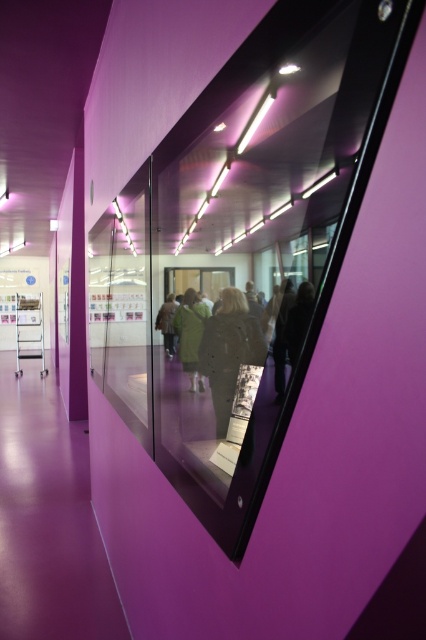
You are standing in the corridor with the purple walls and want to take a photo of the point at coordinates (230,305). Is the point within your camera frame?

The point at coordinates (230,305) is 1.01 meters away from the camera, so it is within the camera frame.

You are standing in the corridor and want to hang your dark gray textured coat at center and green fabric jacket at center on the wall hooks. The hooks are arranged in a straight line from left to right. Which coat should you place on the leftmost hook to match their current positions?

The green fabric jacket at center should be placed on the leftmost hook because the dark gray textured coat at center is positioned to its right.

You are standing in the corridor with the purple walls and want to hang both the dark gray fabric coat at center and the green fabric jacket at center on a coat rack. The coat rack has two hooks at the same height. Can you hang both items on the hooks without one overlapping the other?

The dark gray fabric coat at center is taller than the green fabric jacket at center. Since the coat is taller, you should place it on a hook first, then the jacket on the adjacent hook to avoid overlapping.